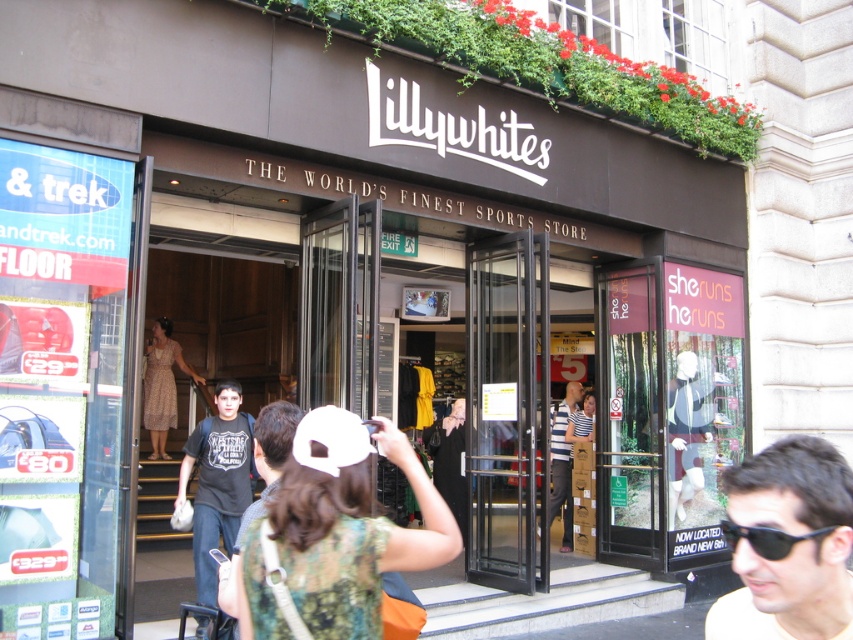
Question: Does dark gray t-shirt at center appear over patterned fabric dress at entrance?

Choices:
 (A) yes
 (B) no

Answer: (B)

Question: Which point is closer to the camera?

Choices:
 (A) (775, 541)
 (B) (434, 525)
 (C) (195, 568)
 (D) (173, 355)

Answer: (A)

Question: Can you confirm if dark gray t-shirt at center is positioned below black plastic sunglasses at lower right?

Choices:
 (A) yes
 (B) no

Answer: (A)

Question: Among these objects, which one is farthest from the camera?

Choices:
 (A) black plastic sunglasses at lower right
 (B) dark gray cotton t-shirt at center
 (C) dark gray t-shirt at center
 (D) patterned fabric dress at entrance

Answer: (D)

Question: From the image, what is the correct spatial relationship of black matte sunglasses at lower right in relation to black plastic sunglasses at lower right?

Choices:
 (A) above
 (B) below

Answer: (B)

Question: Among these objects, which one is farthest from the camera?

Choices:
 (A) black matte sunglasses at lower right
 (B) dark gray t-shirt at center

Answer: (B)